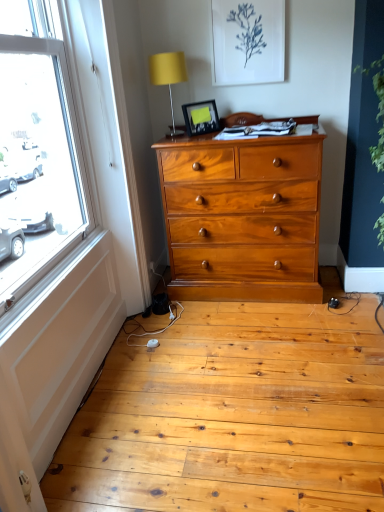
Question: Is matte yellow fabric at upper center completely or partially outside of matte black picture frame at upper center?

Choices:
 (A) no
 (B) yes

Answer: (B)

Question: Is matte black picture frame at upper center inside matte yellow fabric at upper center?

Choices:
 (A) yes
 (B) no

Answer: (B)

Question: Can you confirm if matte yellow fabric at upper center is bigger than matte black picture frame at upper center?

Choices:
 (A) yes
 (B) no

Answer: (A)

Question: From a real-world perspective, is matte yellow fabric at upper center below matte black picture frame at upper center?

Choices:
 (A) no
 (B) yes

Answer: (A)

Question: Considering the relative sizes of matte yellow fabric at upper center and matte black picture frame at upper center in the image provided, is matte yellow fabric at upper center taller than matte black picture frame at upper center?

Choices:
 (A) yes
 (B) no

Answer: (A)

Question: Considering the positions of matte yellow fabric at upper center and green leafy plant at right in the image, is matte yellow fabric at upper center taller or shorter than green leafy plant at right?

Choices:
 (A) short
 (B) tall

Answer: (A)

Question: In terms of size, does matte yellow fabric at upper center appear bigger or smaller than green leafy plant at right?

Choices:
 (A) small
 (B) big

Answer: (A)

Question: From the image's perspective, is matte yellow fabric at upper center above or below green leafy plant at right?

Choices:
 (A) above
 (B) below

Answer: (A)

Question: Does point (172, 66) appear closer or farther from the camera than point (372, 76)?

Choices:
 (A) closer
 (B) farther

Answer: (B)

Question: Is green leafy plant at right to the left or to the right of matte black picture frame at upper center in the image?

Choices:
 (A) left
 (B) right

Answer: (B)

Question: Considering their positions, is green leafy plant at right located in front of or behind matte black picture frame at upper center?

Choices:
 (A) behind
 (B) front

Answer: (B)

Question: From a real-world perspective, is green leafy plant at right above or below matte black picture frame at upper center?

Choices:
 (A) above
 (B) below

Answer: (B)

Question: Is green leafy plant at right bigger or smaller than matte black picture frame at upper center?

Choices:
 (A) big
 (B) small

Answer: (A)

Question: Looking at the image, does matte black picture frame at upper center seem bigger or smaller compared to matte yellow fabric at upper center?

Choices:
 (A) small
 (B) big

Answer: (A)

Question: In terms of height, does matte black picture frame at upper center look taller or shorter compared to matte yellow fabric at upper center?

Choices:
 (A) short
 (B) tall

Answer: (A)